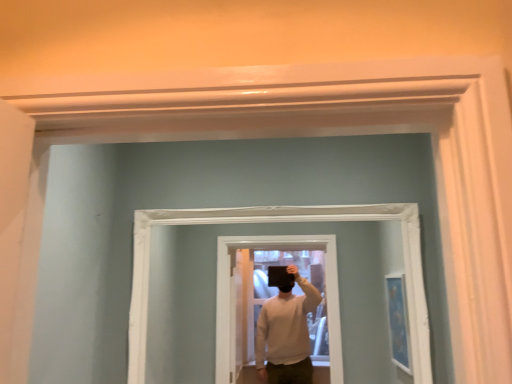
Locate an element on the screen. The height and width of the screenshot is (384, 512). free point above white painted wood at center (from a real-world perspective) is located at coordinates (270, 202).